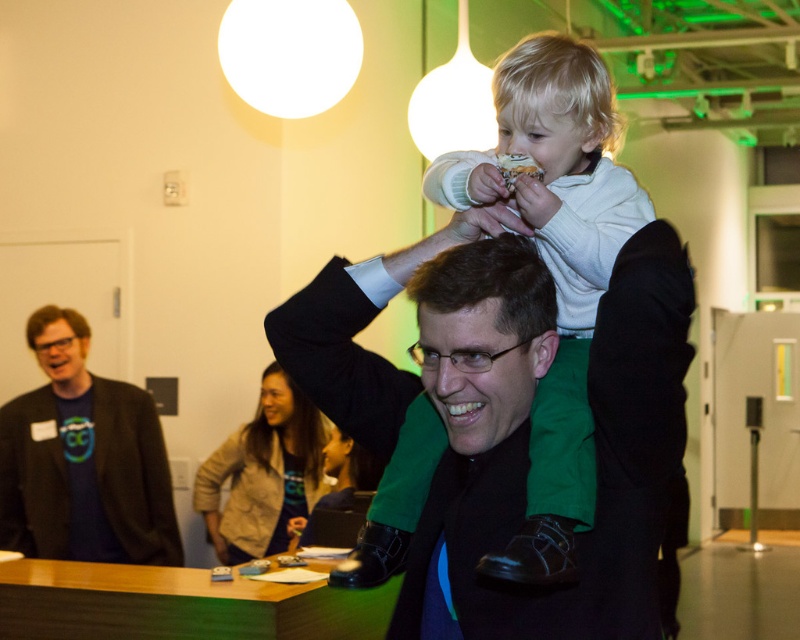
You are organizing a photo shoot and need to ensure that the light brown fabric jacket at center and the smooth brown hair at center are both visible in the frame. Given their sizes, which object should you prioritize keeping within the camera frame?

The light brown fabric jacket at center should be prioritized because its width is larger than the smooth brown hair at center, making it more noticeable and important to capture in the frame.

In the scene shown: You are a photographer at the event and want to capture a closeup of the light brown fabric jacket at center and the smooth brown hair at center. Which object should you focus on first to ensure both are in focus?

The light brown fabric jacket at center is closer to the viewer than the smooth brown hair at center, so focus on the light brown fabric jacket at center first to ensure both are in focus.

From the picture: In the image, there is a man wearing glasses and a dark suit jacket holding a young child on his shoulders. The child is wearing a white sweater and green pants. There is also a light brown fabric jacket at center located at point (262, 474). If you were to draw a straight line from the man to the light brown fabric jacket at center, would it pass through the child?

The light brown fabric jacket at center is located at point (262, 474). Since the man is holding the child on his shoulders, the straight line from the man to the jacket would pass through the child.